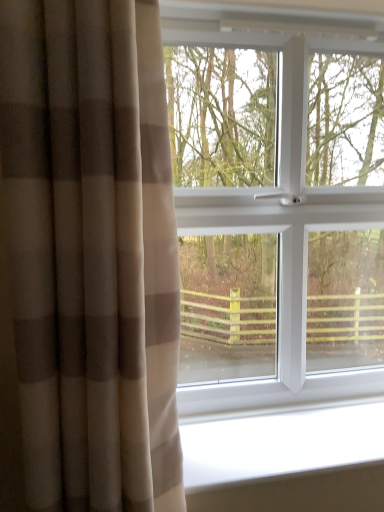
Question: From the image's perspective, is beige textured curtain at left over white smooth window sill at lower center?

Choices:
 (A) no
 (B) yes

Answer: (B)

Question: Is the position of beige textured curtain at left more distant than that of white smooth window sill at lower center?

Choices:
 (A) yes
 (B) no

Answer: (B)

Question: Considering the relative sizes of beige textured curtain at left and white smooth window sill at lower center in the image provided, is beige textured curtain at left bigger than white smooth window sill at lower center?

Choices:
 (A) yes
 (B) no

Answer: (A)

Question: Can you confirm if beige textured curtain at left is positioned to the left of white smooth window sill at lower center?

Choices:
 (A) no
 (B) yes

Answer: (B)

Question: Considering the relative positions of beige textured curtain at left and white smooth window sill at lower center in the image provided, is beige textured curtain at left to the right of white smooth window sill at lower center from the viewer's perspective?

Choices:
 (A) no
 (B) yes

Answer: (A)

Question: Is white smooth window sill at lower center inside beige textured curtain at left?

Choices:
 (A) yes
 (B) no

Answer: (B)

Question: Considering the relative positions of white plastic window at center and white smooth window sill at lower center in the image provided, is white plastic window at center behind white smooth window sill at lower center?

Choices:
 (A) yes
 (B) no

Answer: (A)

Question: From a real-world perspective, is white plastic window at center located beneath white smooth window sill at lower center?

Choices:
 (A) yes
 (B) no

Answer: (B)

Question: Is white plastic window at center far from white smooth window sill at lower center?

Choices:
 (A) no
 (B) yes

Answer: (A)

Question: Is white plastic window at center oriented towards white smooth window sill at lower center?

Choices:
 (A) yes
 (B) no

Answer: (A)

Question: Does white plastic window at center touch white smooth window sill at lower center?

Choices:
 (A) yes
 (B) no

Answer: (B)

Question: Can you confirm if white plastic window at center is positioned to the left of white smooth window sill at lower center?

Choices:
 (A) no
 (B) yes

Answer: (B)

Question: Does white smooth window sill at lower center have a greater height compared to white plastic window at center?

Choices:
 (A) yes
 (B) no

Answer: (B)